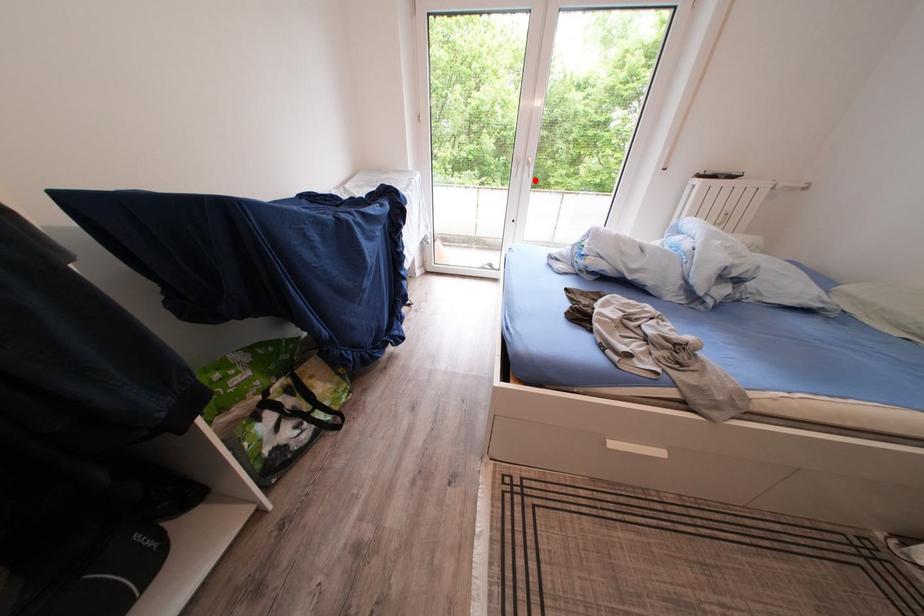
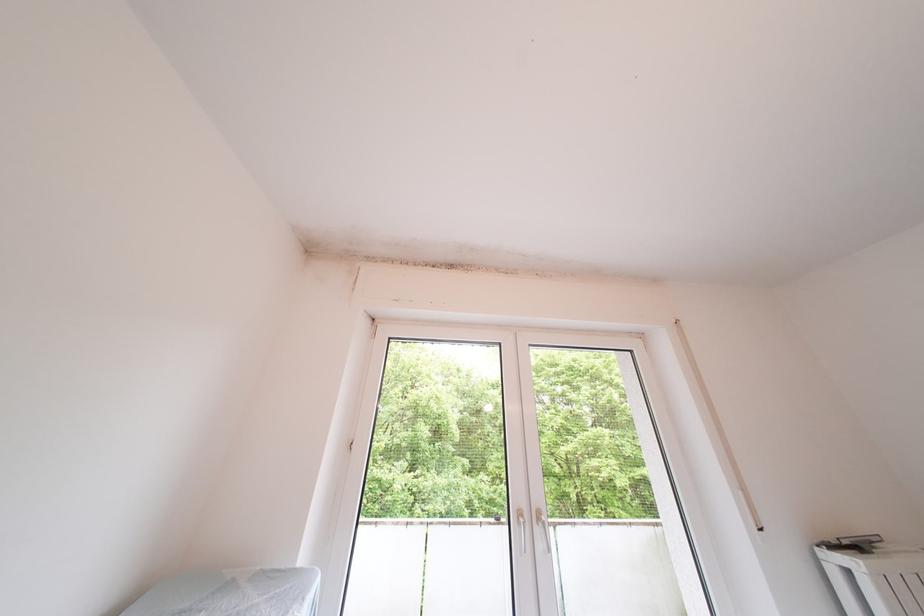
Where in the second image is the point corresponding to the highlighted location from the first image?

(550, 552)